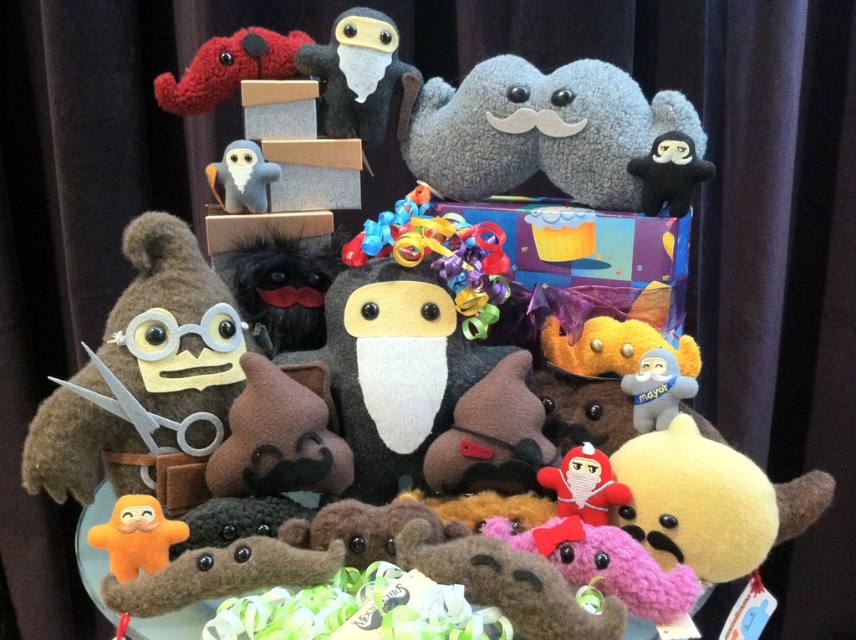
Looking at this image, you are looking at the table with the plush toys. Which one is nearer to you between the fluffy gray plush at center and the gray felt owl at center?

The fluffy gray plush at center is closer to the viewer than the gray felt owl at center.

Looking at the table with all the plush toys, where is the fluffy gray plush at center in relation to the gray felt owl at center?

The fluffy gray plush at center is located above the gray felt owl at center.